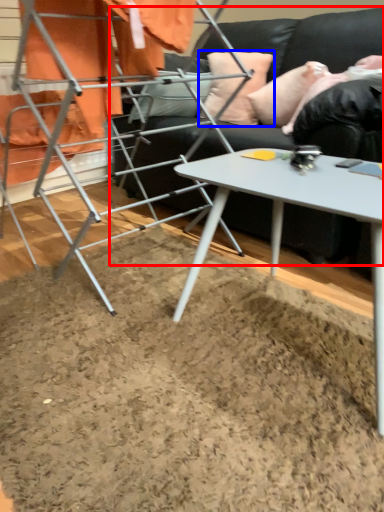
Question: Among these objects, which one is nearest to the camera, studio couch (highlighted by a red box) or pillow (highlighted by a blue box)?

Choices:
 (A) studio couch
 (B) pillow

Answer: (A)